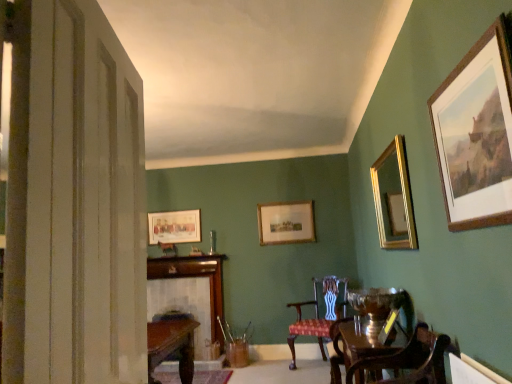
Question: Does matte gold picture frame at upper left, arranged as the 4th picture frame when viewed from the front, have a lesser width compared to wooden framed picture at center, the third picture frame positioned from the front?

Choices:
 (A) yes
 (B) no

Answer: (A)

Question: From the image's perspective, would you say matte gold picture frame at upper left, arranged as the 4th picture frame when viewed from the front, is positioned over wooden framed picture at center, arranged as the second picture frame when viewed from the back?

Choices:
 (A) no
 (B) yes

Answer: (A)

Question: From a real-world perspective, is matte gold picture frame at upper left, which ranks as the first picture frame in back-to-front order, on wooden framed picture at center, which ranks as the 2th picture frame in left-to-right order?

Choices:
 (A) no
 (B) yes

Answer: (B)

Question: Is matte gold picture frame at upper left, the fourth picture frame from the right, turned away from wooden framed picture at center, which ranks as the 2th picture frame in left-to-right order?

Choices:
 (A) no
 (B) yes

Answer: (A)

Question: Does matte gold picture frame at upper left, the fourth picture frame from the right, have a larger size compared to wooden framed picture at center, the third picture frame positioned from the front?

Choices:
 (A) yes
 (B) no

Answer: (B)

Question: In terms of size, does red upholstered chair at center, positioned as the 2th chair in front-to-back order, appear bigger or smaller than shiny brown wood round table at lower right?

Choices:
 (A) big
 (B) small

Answer: (A)

Question: Is point (331, 299) positioned closer to the camera than point (336, 342)?

Choices:
 (A) farther
 (B) closer

Answer: (A)

Question: From the image's perspective, is red upholstered chair at center, positioned as the 2th chair in front-to-back order, positioned above or below shiny brown wood round table at lower right?

Choices:
 (A) above
 (B) below

Answer: (B)

Question: Is red upholstered chair at center, marked as the first chair in a bottom-to-top arrangement, inside the boundaries of shiny brown wood round table at lower right, or outside?

Choices:
 (A) inside
 (B) outside

Answer: (B)

Question: From the image's perspective, is mahogany wood chair at lower right, which ranks as the second chair in back-to-front order, above or below matte gold picture frame at upper left, which ranks as the first picture frame in back-to-front order?

Choices:
 (A) below
 (B) above

Answer: (A)

Question: Do you think mahogany wood chair at lower right, arranged as the 1th chair when viewed from the front, is within matte gold picture frame at upper left, which appears as the first picture frame when viewed from the left, or outside of it?

Choices:
 (A) outside
 (B) inside

Answer: (A)

Question: In the image, is mahogany wood chair at lower right, arranged as the 1th chair when viewed from the front, positioned in front of or behind matte gold picture frame at upper left, which appears as the first picture frame when viewed from the left?

Choices:
 (A) behind
 (B) front

Answer: (B)

Question: Considering the positions of mahogany wood chair at lower right, acting as the second chair starting from the bottom, and matte gold picture frame at upper left, arranged as the 4th picture frame when viewed from the front, in the image, is mahogany wood chair at lower right, acting as the second chair starting from the bottom, bigger or smaller than matte gold picture frame at upper left, arranged as the 4th picture frame when viewed from the front,?

Choices:
 (A) big
 (B) small

Answer: (A)

Question: Is wooden fireplace at center taller or shorter than shiny brown wood round table at lower right?

Choices:
 (A) short
 (B) tall

Answer: (B)

Question: Considering the relative positions of wooden fireplace at center and shiny brown wood round table at lower right in the image provided, is wooden fireplace at center to the left or to the right of shiny brown wood round table at lower right?

Choices:
 (A) right
 (B) left

Answer: (B)